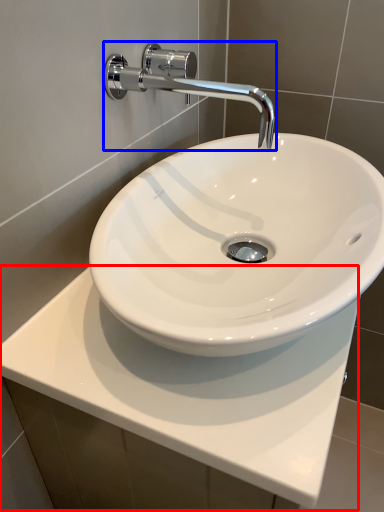
Question: Which point is closer to the camera, counter top (highlighted by a red box) or tap (highlighted by a blue box)?

Choices:
 (A) counter top
 (B) tap

Answer: (A)